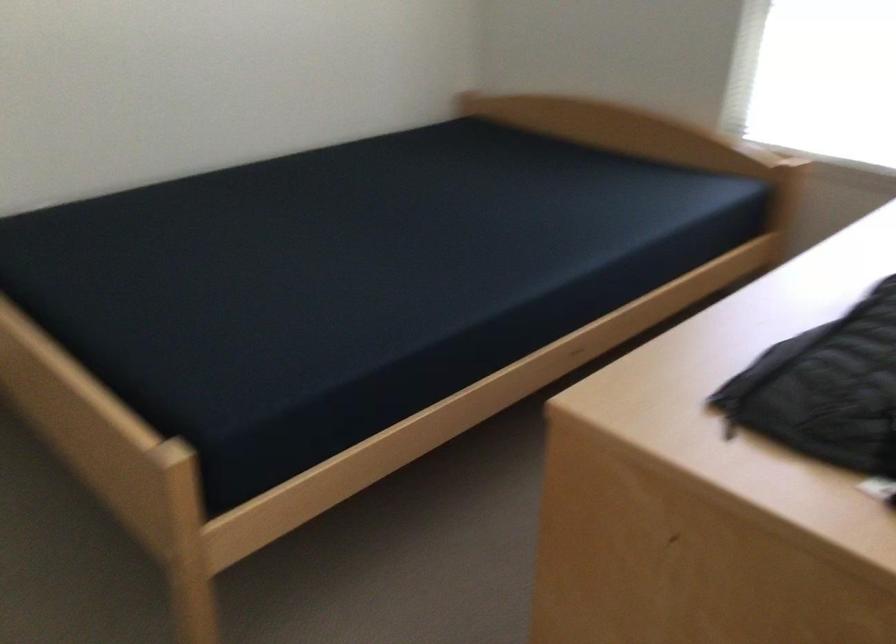
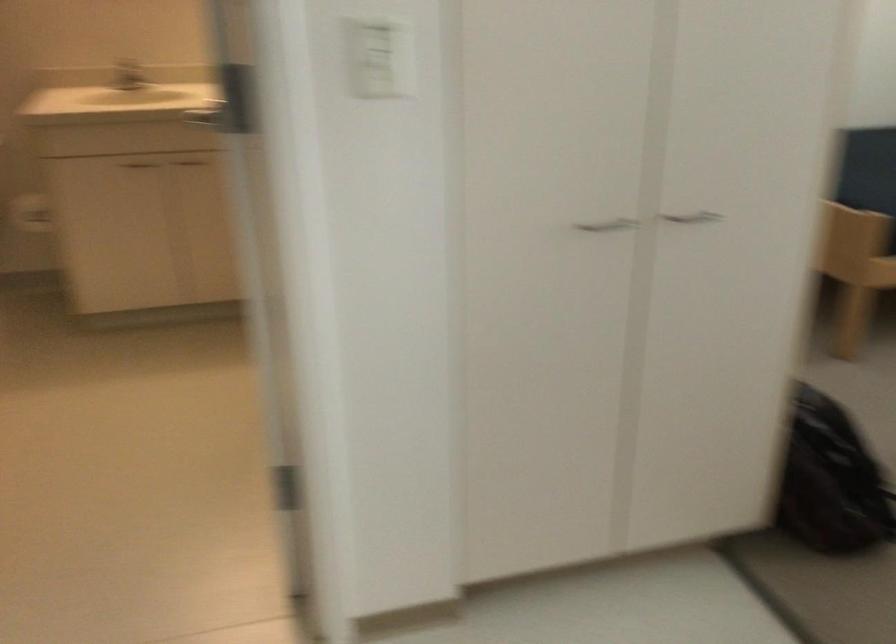
Find the pixel in the second image that matches [194,545] in the first image.

(855, 269)